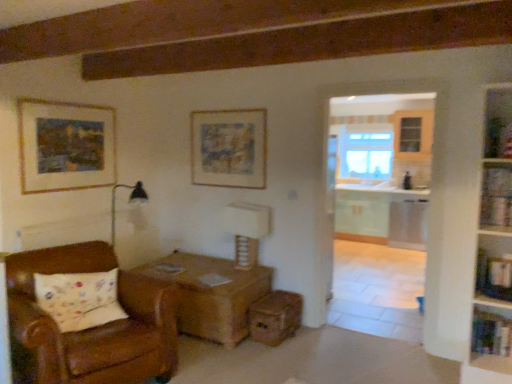
Question: From a real-world perspective, is clear glass window at center physically located above or below white textured table lamp at center?

Choices:
 (A) below
 (B) above

Answer: (B)

Question: Is point (340, 140) positioned closer to the camera than point (250, 236)?

Choices:
 (A) closer
 (B) farther

Answer: (B)

Question: Which object is the closest to the wooden drawer at lower center?

Choices:
 (A) matte paper picture frame at upper center, the first picture frame viewed from the right
 (B) wooden picture frame at upper left, the first picture frame positioned from the left
 (C) wooden bookshelf at right, marked as the second shelf in a top-to-bottom arrangement
 (D) wooden bookshelf at upper right, marked as the first shelf in a top-to-bottom arrangement
 (E) clear glass window at center

Answer: (A)

Question: Estimate the real-world distances between objects in this image. Which object is farther from the white textured table lamp at center?

Choices:
 (A) wooden shelf at lower right, the 3th shelf when ordered from top to bottom
 (B) wooden picture frame at upper left, the first picture frame positioned from the left
 (C) wooden bookshelf at right, the 2th shelf when ordered from bottom to top
 (D) brown leather chair at lower left
 (E) clear glass window at center

Answer: (E)